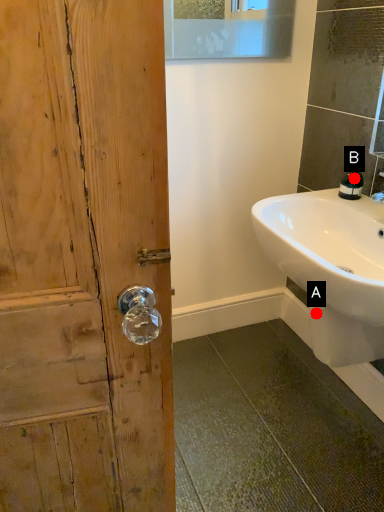
Question: Two points are circled on the image, labeled by A and B beside each circle. Which point is closer to the camera?

Choices:
 (A) A is closer
 (B) B is closer

Answer: (A)